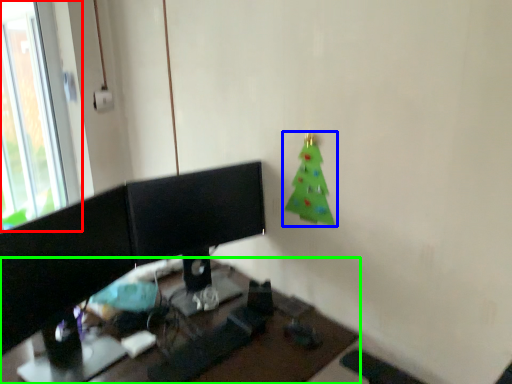
Question: Considering the real-world distances, which object is closest to window (highlighted by a red box)? christmas tree (highlighted by a blue box) or desk (highlighted by a green box).

Choices:
 (A) christmas tree
 (B) desk

Answer: (B)